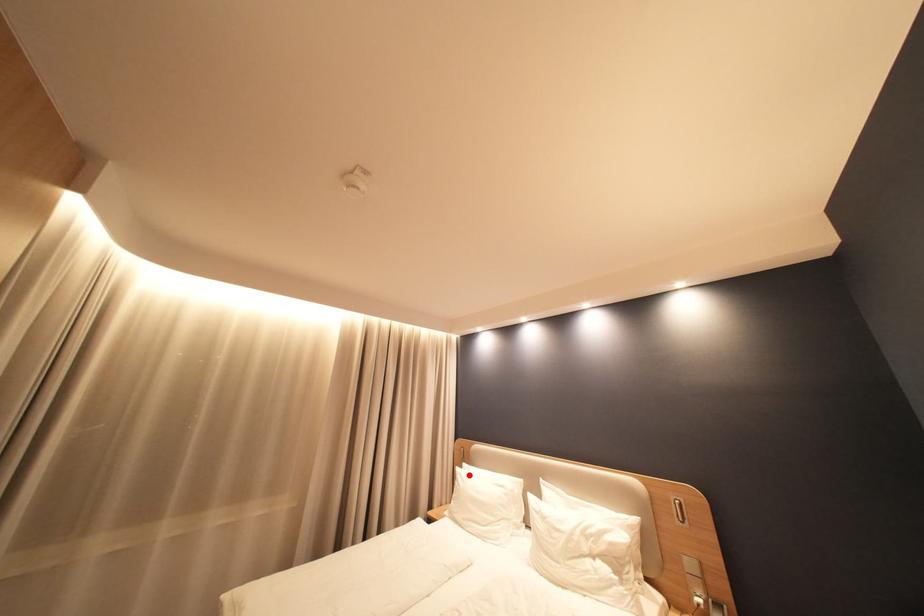
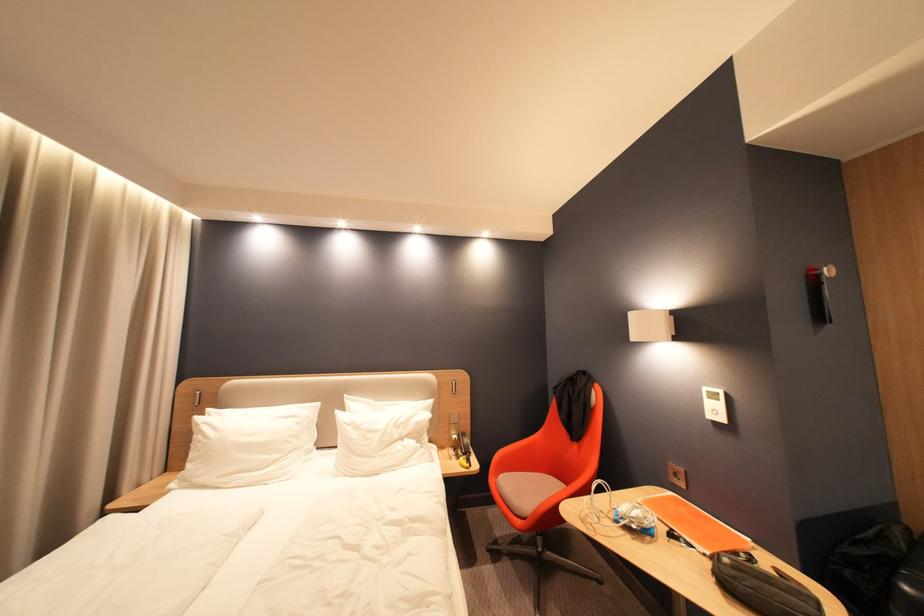
Question: I am providing you with two images of the same scene from different viewpoints. A red point is shown in image1. For the corresponding object point in image2, is it positioned nearer or farther from the camera?

Choices:
 (A) Nearer
 (B) Farther

Answer: (A)